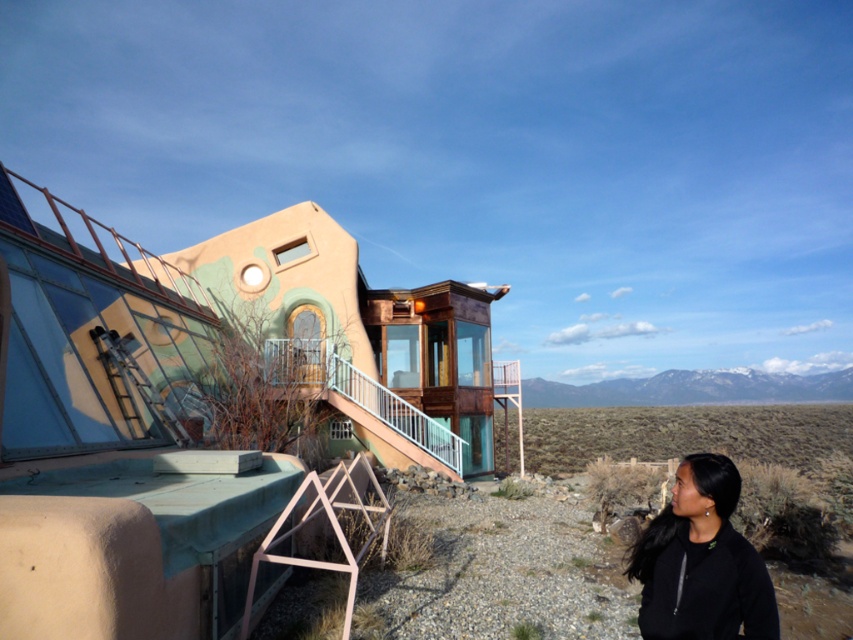
Describe the element at coordinates (498, 570) in the screenshot. Image resolution: width=853 pixels, height=640 pixels. I see `desert gravel at lower center` at that location.

This screenshot has height=640, width=853. Find the location of `desert gravel at lower center`. desert gravel at lower center is located at coordinates (498, 570).

Does point (624, 451) lie in front of point (743, 627)?

No, it is behind (743, 627).

You are a GUI agent. You are given a task and a screenshot of the screen. Output one action in this format:
    pyautogui.click(x=<x>, y=<y>)
    Task: Click on the desert gravel at lower center
    Image resolution: width=853 pixels, height=640 pixels.
    Given the screenshot: What is the action you would take?
    click(498, 570)